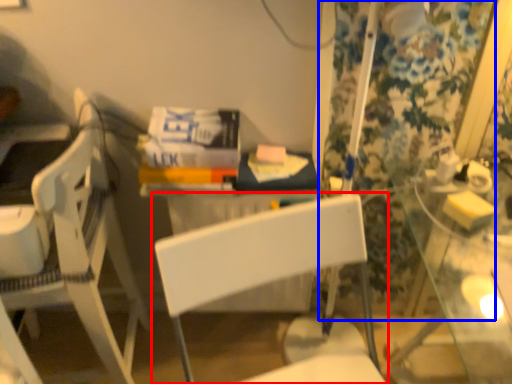
Question: Which point is further to the camera, chair (highlighted by a red box) or curtain (highlighted by a blue box)?

Choices:
 (A) chair
 (B) curtain

Answer: (B)